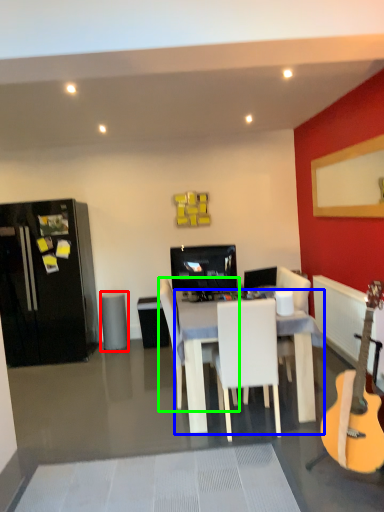
Question: Estimate the real-world distances between objects in this image. Which object is closer to trash bin/can (highlighted by a red box), desk (highlighted by a blue box) or chair (highlighted by a green box)?

Choices:
 (A) desk
 (B) chair

Answer: (B)